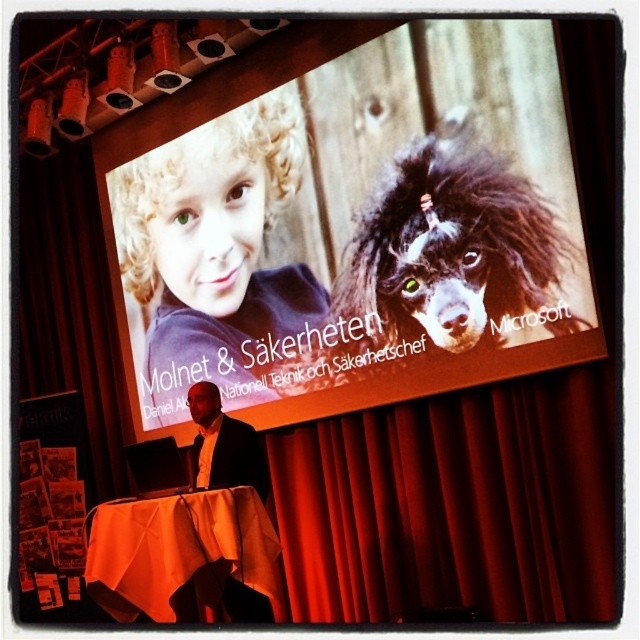
Question: Estimate the real-world distances between objects in this image. Which object is farther from the orange fabric table at lower left?

Choices:
 (A) dark suit at center
 (B) curly blonde hair at upper left
 (C) red velvet curtain at center

Answer: (B)

Question: Is orange fabric table at lower left wider than dark suit at center?

Choices:
 (A) yes
 (B) no

Answer: (A)

Question: Is curly blonde hair at upper left to the right of orange fabric table at lower left from the viewer's perspective?

Choices:
 (A) yes
 (B) no

Answer: (B)

Question: Which object is closer to the camera taking this photo?

Choices:
 (A) orange fabric table at lower left
 (B) curly blonde hair at upper left
 (C) dark suit at center
 (D) red velvet curtain at center

Answer: (A)

Question: Is curly blonde hair at upper left below orange fabric table at lower left?

Choices:
 (A) yes
 (B) no

Answer: (B)

Question: Estimate the real-world distances between objects in this image. Which object is closer to the dark suit at center?

Choices:
 (A) curly blonde hair at upper left
 (B) orange fabric table at lower left

Answer: (B)